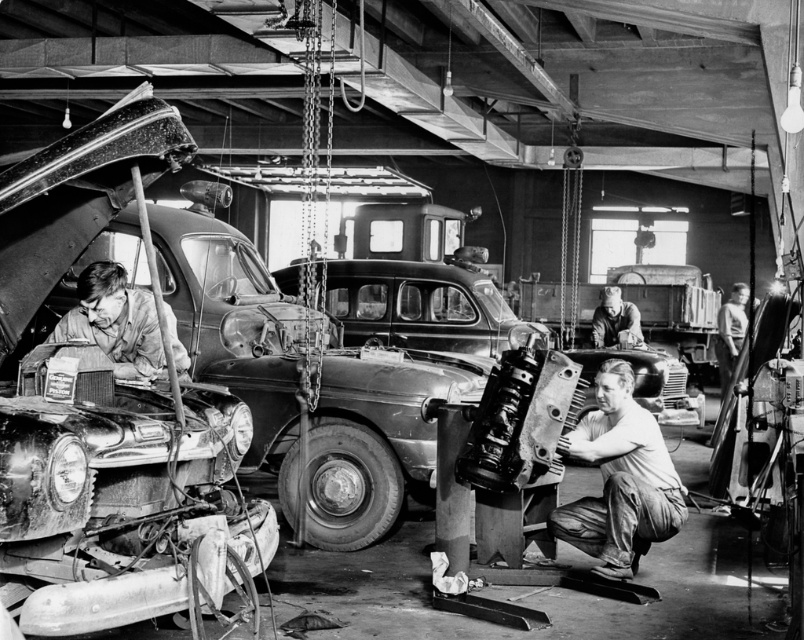
Does point (731, 349) come closer to viewer compared to point (610, 333)?

No, (731, 349) is further to viewer.

Who is more forward, (725, 304) or (618, 333)?

Point (618, 333) is more forward.

Find the location of `light brown leather jacket at upper right`. light brown leather jacket at upper right is located at coordinates (729, 333).

Locate an element on the screen. This screenshot has width=804, height=640. light brown leather jacket at upper right is located at coordinates (729, 333).

Does shiny chrome engine at left come behind matte brown jacket at left?

Yes, it is behind matte brown jacket at left.

Does shiny chrome engine at left appear on the left side of matte brown jacket at left?

Incorrect, shiny chrome engine at left is not on the left side of matte brown jacket at left.

This screenshot has height=640, width=804. Describe the element at coordinates (236, 330) in the screenshot. I see `shiny chrome engine at left` at that location.

Where is `shiny chrome engine at left`? Image resolution: width=804 pixels, height=640 pixels. shiny chrome engine at left is located at coordinates (236, 330).

Consider the image. Is smooth metal cylinder at center bigger than matte brown jacket at left?

Yes, smooth metal cylinder at center is bigger than matte brown jacket at left.

In the scene shown: Does smooth metal cylinder at center lie in front of matte brown jacket at left?

No, it is not.

You are a GUI agent. You are given a task and a screenshot of the screen. Output one action in this format:
    pyautogui.click(x=<x>, y=<y>)
    Task: Click on the smooth metal cylinder at center
    
    Given the screenshot: What is the action you would take?
    pyautogui.click(x=620, y=480)